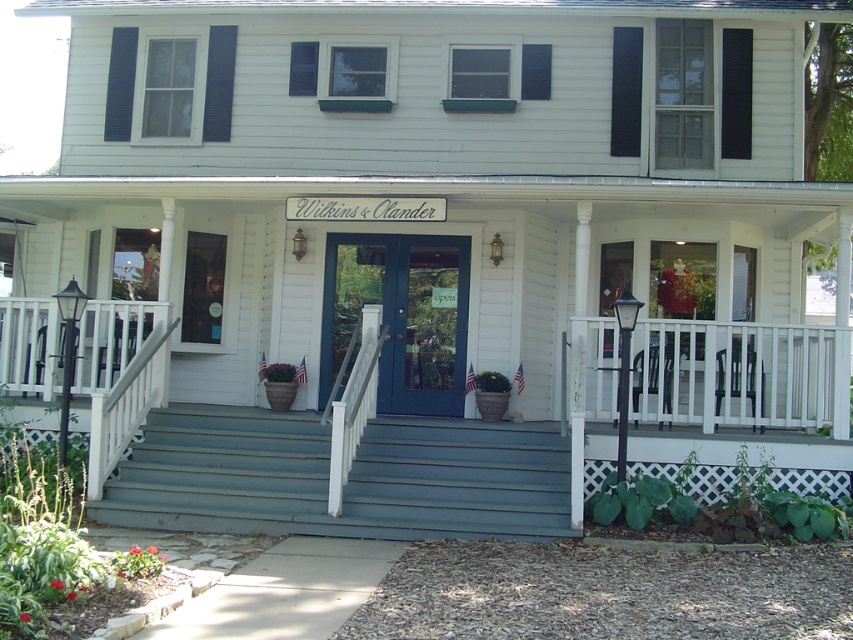
Question: Among these points, which one is nearest to the camera?

Choices:
 (A) (424, 532)
 (B) (105, 224)

Answer: (A)

Question: Observing the image, what is the correct spatial positioning of white wooden porch at center in reference to teal painted wood stairs at center?

Choices:
 (A) above
 (B) below

Answer: (A)

Question: Observing the image, what is the correct spatial positioning of white wooden porch at center in reference to teal painted wood stairs at center?

Choices:
 (A) right
 (B) left

Answer: (A)

Question: Is white wooden porch at center bigger than teal painted wood stairs at center?

Choices:
 (A) no
 (B) yes

Answer: (B)